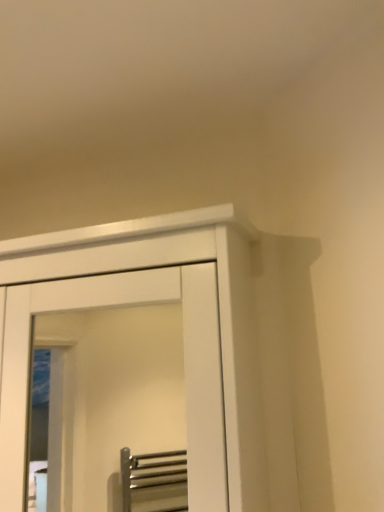
In order to face white glossy cabinet at upper center, should I rotate leftwards or rightwards?

To face it directly, rotate left by 13.595 degrees.

What do you see at coordinates (220, 334) in the screenshot?
I see `white glossy cabinet at upper center` at bounding box center [220, 334].

Find the location of `white glossy cabinet at upper center`. white glossy cabinet at upper center is located at coordinates (220, 334).

This screenshot has width=384, height=512. What are the coordinates of `white glossy cabinet at upper center` in the screenshot? It's located at (220, 334).